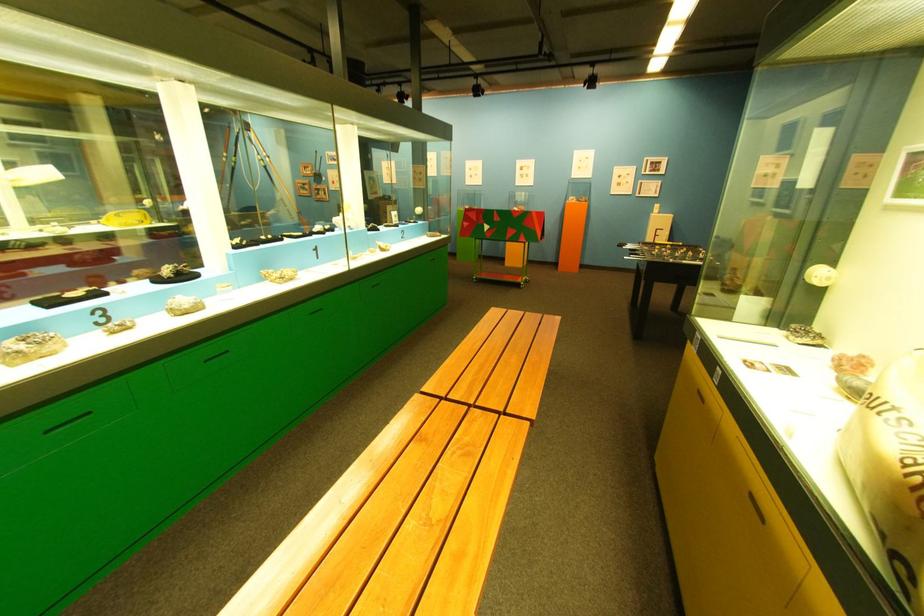
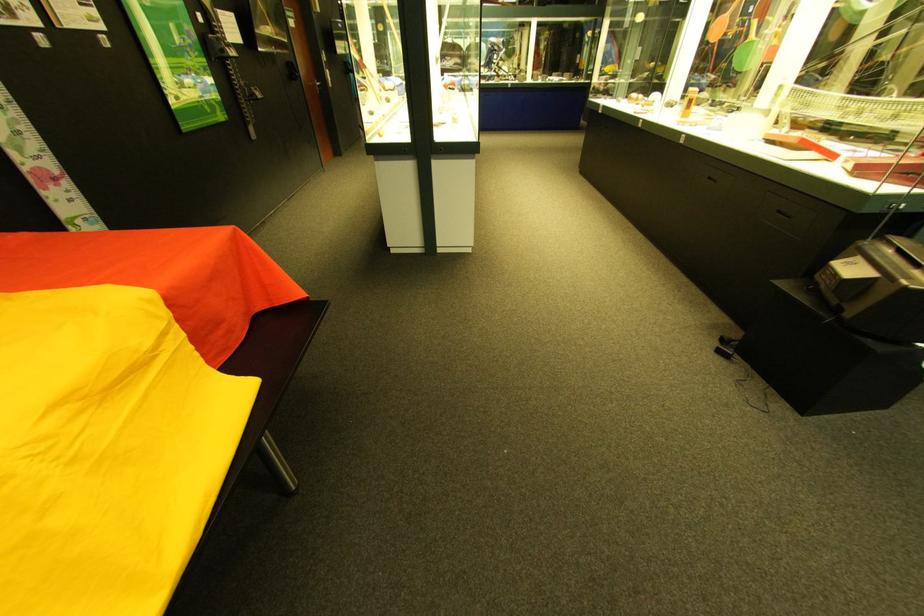
Question: I am providing you with two images of the same scene from different viewpoints. Which of the following objects are not visible in image2?

Choices:
 (A) green cabinet handle
 (B) silver door handle
 (C) black drawer pull
 (D) stovetop control knob

Answer: (A)